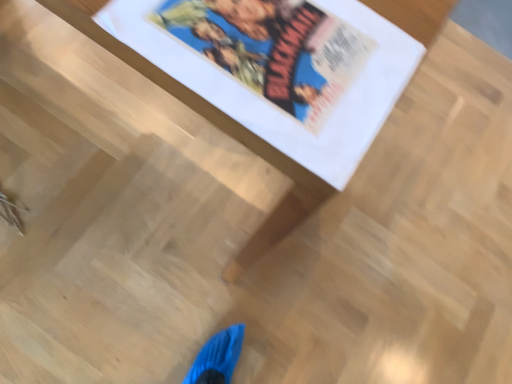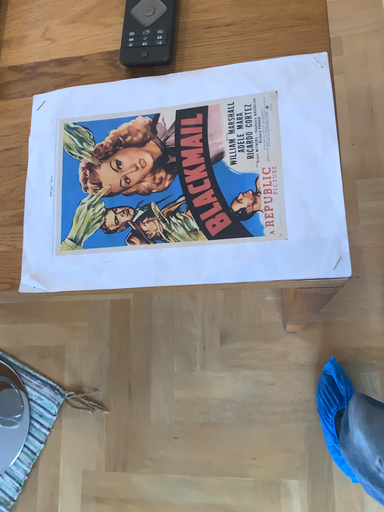
Question: Which way did the camera rotate in the video?

Choices:
 (A) rotated upward
 (B) rotated downward

Answer: (B)